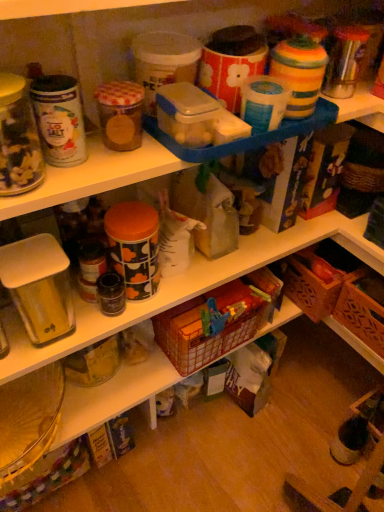
What are the coordinates of `vacant space underneath brown woven basket at lower right, positioned as the 1th basket in right-to-left order (from a real-world perspective)` in the screenshot? It's located at (352, 385).